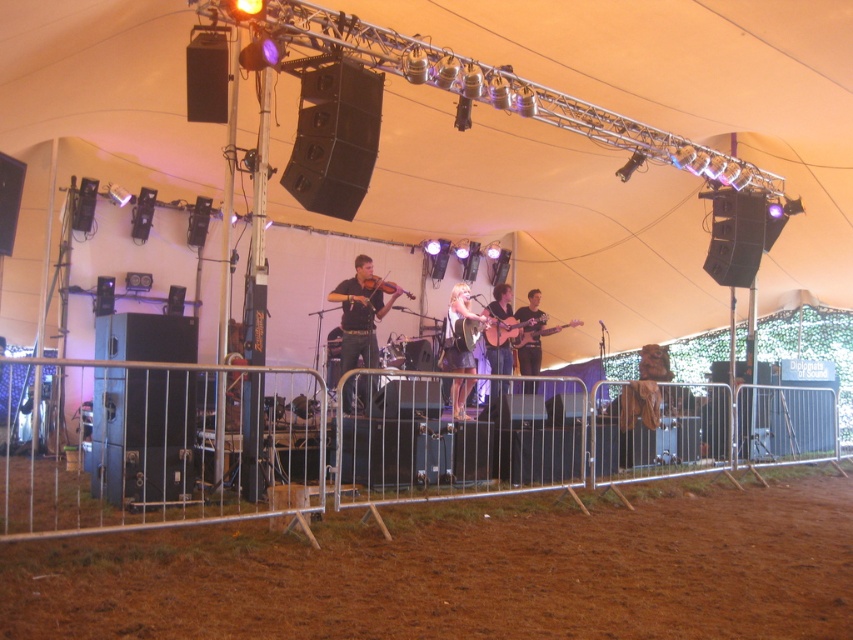
Question: Which point is farther to the camera?

Choices:
 (A) (538, 321)
 (B) (384, 280)

Answer: (B)

Question: Does matte black guitar at center lie in front of wooden acoustic guitar at center?

Choices:
 (A) no
 (B) yes

Answer: (B)

Question: Estimate the real-world distances between objects in this image. Which object is farther from the dark brown leather guitar at center?

Choices:
 (A) matte black guitar at center
 (B) wooden acoustic guitar at center
 (C) wooden violin at center
 (D) acoustic wood guitar at center

Answer: (C)

Question: Estimate the real-world distances between objects in this image. Which object is closer to the wooden acoustic guitar at center?

Choices:
 (A) light brown wood guitar at center
 (B) matte black guitar at center

Answer: (B)

Question: Does light brown wood guitar at center come in front of matte black guitar at center?

Choices:
 (A) yes
 (B) no

Answer: (A)

Question: Does wooden acoustic guitar at center appear over wooden violin at center?

Choices:
 (A) no
 (B) yes

Answer: (A)